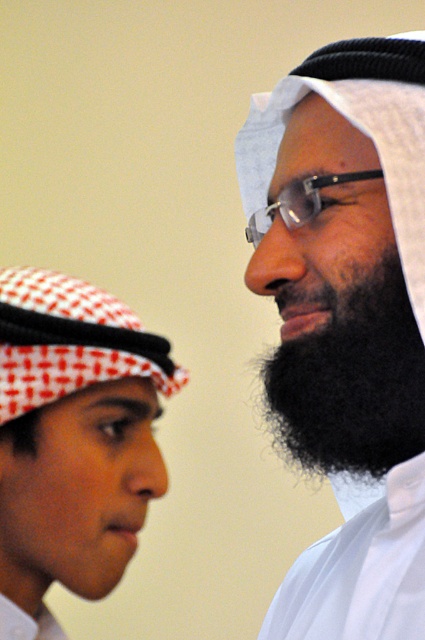
From the picture: Does black matte beard at center have a lesser height compared to black fuzzy beard at right?

No.

Between black matte beard at center and black fuzzy beard at right, which one appears on the left side from the viewer's perspective?

Positioned to the left is black matte beard at center.

Measure the distance between black matte beard at center and camera.

They are 20.05 inches apart.

At what (x,y) coordinates should I click in order to perform the action: click on black matte beard at center. Please return your answer as a coordinate pair (x, y). Looking at the image, I should click on (346, 320).

Does point (96, 547) come closer to viewer compared to point (382, 422)?

Yes, point (96, 547) is closer to viewer.

Between point (40, 512) and point (385, 422), which one is positioned behind?

Point (385, 422)

At what (x,y) coordinates should I click in order to perform the action: click on white checkered headscarf at left. Please return your answer as a coordinate pair (x, y). Looking at the image, I should click on (73, 435).

Is black matte beard at center taller than white checkered headscarf at left?

Yes, black matte beard at center is taller than white checkered headscarf at left.

Is point (368, 416) positioned behind point (112, 438)?

That is True.

The image size is (425, 640). Identify the location of black matte beard at center. (346, 320).